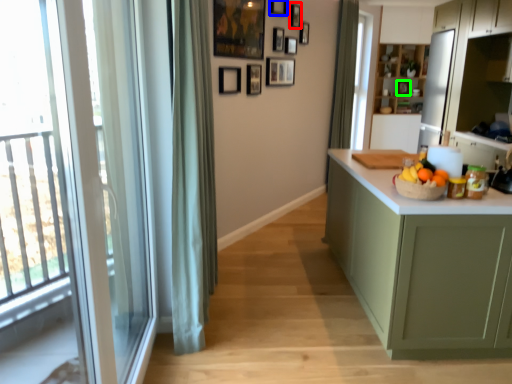
Question: Based on their relative distances, which object is nearer to picture frame (highlighted by a red box)? Choose from picture frame (highlighted by a blue box) and picture frame (highlighted by a green box).

Choices:
 (A) picture frame
 (B) picture frame

Answer: (A)